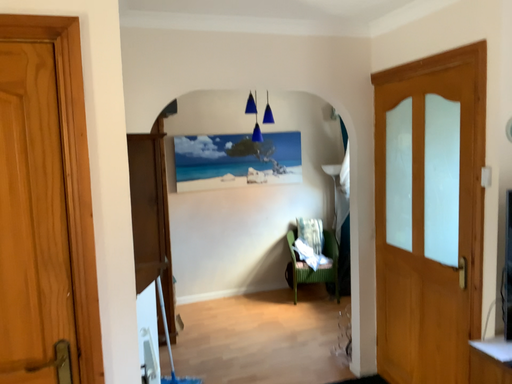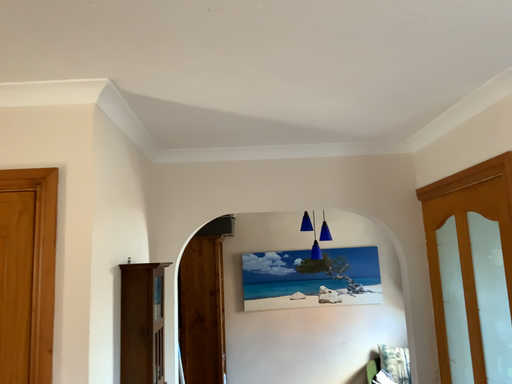
Question: How did the camera likely rotate when shooting the video?

Choices:
 (A) rotated left
 (B) rotated right

Answer: (A)